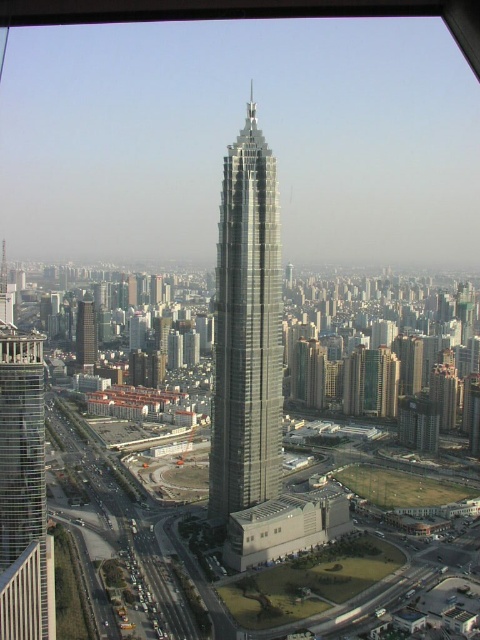
Question: Which of the following is the closest to the observer?

Choices:
 (A) transparent glass window at center
 (B) silver glass skyscraper at center

Answer: (A)

Question: Is silver glass skyscraper at center further to camera compared to glassy silver skyscraper at left?

Choices:
 (A) no
 (B) yes

Answer: (B)

Question: Considering the real-world distances, which object is farthest from the smooth glass skyscraper at center?

Choices:
 (A) glassy silver skyscraper at left
 (B) silver glass skyscraper at center

Answer: (A)

Question: Does glassy silver skyscraper at left have a lesser width compared to transparent glass window at center?

Choices:
 (A) no
 (B) yes

Answer: (A)

Question: Which point is closer to the camera taking this photo?

Choices:
 (A) (14, 330)
 (B) (260, 536)
 (C) (88, 362)
 (D) (225, 440)

Answer: (A)

Question: Is silver glass skyscraper at center positioned in front of smooth glass skyscraper at center?

Choices:
 (A) yes
 (B) no

Answer: (A)